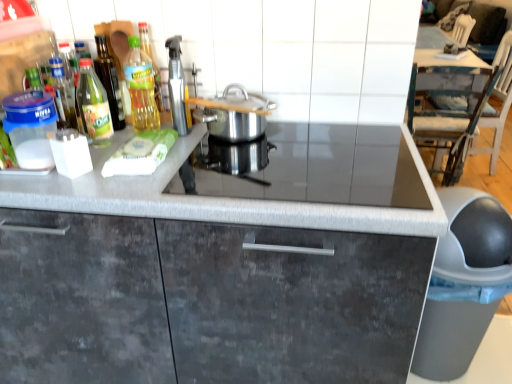
Question: Is polished stainless steel pot at center, acting as the fourth kitchen appliance starting from the left, far from green glass bottle at upper left, the third kitchen appliance when ordered from right to left?

Choices:
 (A) no
 (B) yes

Answer: (A)

Question: Is the depth of polished stainless steel pot at center, acting as the fourth kitchen appliance starting from the left, less than that of green glass bottle at upper left, which ranks as the 2th kitchen appliance in left-to-right order?

Choices:
 (A) no
 (B) yes

Answer: (B)

Question: Can you confirm if polished stainless steel pot at center, acting as the fourth kitchen appliance starting from the left, is positioned to the right of green glass bottle at upper left, which ranks as the 2th kitchen appliance in left-to-right order?

Choices:
 (A) no
 (B) yes

Answer: (B)

Question: Is polished stainless steel pot at center, acting as the fourth kitchen appliance starting from the left, facing towards green glass bottle at upper left, which ranks as the 2th kitchen appliance in left-to-right order?

Choices:
 (A) no
 (B) yes

Answer: (A)

Question: Considering the relative sizes of polished stainless steel pot at center, acting as the 1th kitchen appliance starting from the right, and green glass bottle at upper left, the third kitchen appliance when ordered from right to left, in the image provided, is polished stainless steel pot at center, acting as the 1th kitchen appliance starting from the right, bigger than green glass bottle at upper left, the third kitchen appliance when ordered from right to left,?

Choices:
 (A) yes
 (B) no

Answer: (A)

Question: Is black glass gas stove at center bigger or smaller than green glass bottle at upper left, the third kitchen appliance when ordered from right to left?

Choices:
 (A) big
 (B) small

Answer: (A)

Question: From the image's perspective, is black glass gas stove at center positioned above or below green glass bottle at upper left, which ranks as the 2th kitchen appliance in left-to-right order?

Choices:
 (A) above
 (B) below

Answer: (B)

Question: In the image, is black glass gas stove at center on the left side or the right side of green glass bottle at upper left, which ranks as the 2th kitchen appliance in left-to-right order?

Choices:
 (A) left
 (B) right

Answer: (B)

Question: Is black glass gas stove at center inside or outside of green glass bottle at upper left, which ranks as the 2th kitchen appliance in left-to-right order?

Choices:
 (A) outside
 (B) inside

Answer: (A)

Question: In terms of width, does silver metallic spray bottle at upper center, the 2th kitchen appliance from the right, look wider or thinner when compared to green glass bottle at left, arranged as the fourth kitchen appliance when viewed from the right?

Choices:
 (A) thin
 (B) wide

Answer: (A)

Question: Is point pyautogui.click(x=188, y=119) positioned closer to the camera than point pyautogui.click(x=84, y=117)?

Choices:
 (A) farther
 (B) closer

Answer: (A)

Question: From the image's perspective, is silver metallic spray bottle at upper center, placed as the 3th kitchen appliance when sorted from left to right, positioned above or below green glass bottle at left, arranged as the fourth kitchen appliance when viewed from the right?

Choices:
 (A) below
 (B) above

Answer: (B)

Question: Is silver metallic spray bottle at upper center, placed as the 3th kitchen appliance when sorted from left to right, in front of or behind green glass bottle at left, the first kitchen appliance viewed from the left, in the image?

Choices:
 (A) behind
 (B) front

Answer: (A)

Question: In terms of height, does black glass gas stove at center look taller or shorter compared to green glass bottle at left, the first kitchen appliance viewed from the left?

Choices:
 (A) short
 (B) tall

Answer: (A)

Question: Is black glass gas stove at center spatially inside green glass bottle at left, the first kitchen appliance viewed from the left, or outside of it?

Choices:
 (A) inside
 (B) outside

Answer: (B)